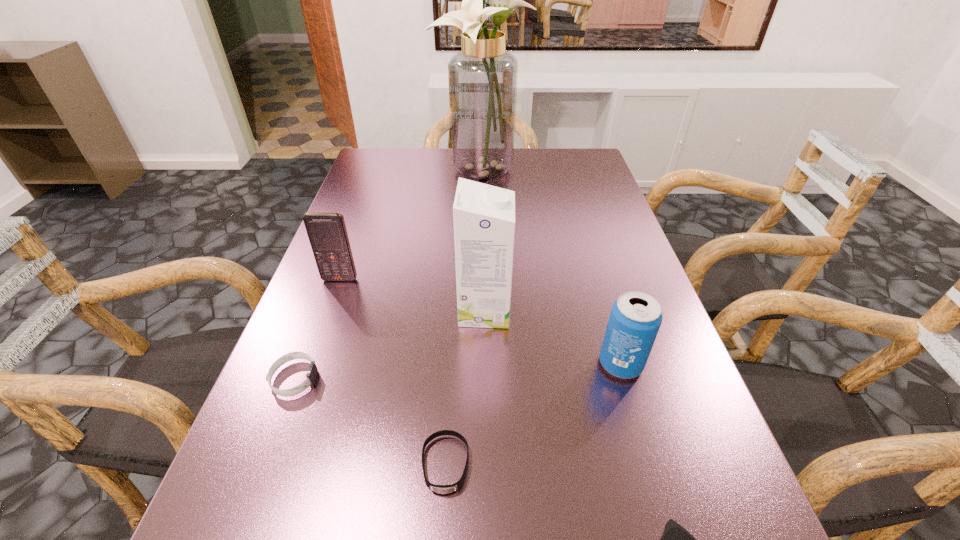
Identify the location of vacant space at the right edge. Image resolution: width=960 pixels, height=540 pixels. (587, 309).

Where is `free point at the far right corner`? The height and width of the screenshot is (540, 960). free point at the far right corner is located at coordinates (588, 151).

Where is `vacant space that is in between the tallest object and the cellular telephone`? vacant space that is in between the tallest object and the cellular telephone is located at coordinates (410, 224).

This screenshot has height=540, width=960. In order to click on empty space that is in between the taller wristband and the tallest object in this screenshot , I will do `click(388, 273)`.

You are a GUI agent. You are given a task and a screenshot of the screen. Output one action in this format:
    pyautogui.click(x=<x>, y=<y>)
    Task: Click on the vacant area that lies between the farther wristband and the cellular telephone
    
    Given the screenshot: What is the action you would take?
    pyautogui.click(x=317, y=329)

Locate an element on the screen. free space between the right wristband and the taller wristband is located at coordinates (370, 421).

Locate an element on the screen. This screenshot has height=540, width=960. free spot between the farther wristband and the carton is located at coordinates (390, 345).

Image resolution: width=960 pixels, height=540 pixels. Find the location of `empty space that is in between the sixth shortest object and the sixth nearest object`. empty space that is in between the sixth shortest object and the sixth nearest object is located at coordinates (413, 295).

Select which object appears as the closest to the nearest object. Please provide its 2D coordinates. Your answer should be formatted as a tuple, i.e. [(x, y)], where the tuple contains the x and y coordinates of a point satisfying the conditions above.

[(635, 318)]

This screenshot has height=540, width=960. I want to click on object that stands as the sixth closest to the sixth farthest object, so click(x=483, y=76).